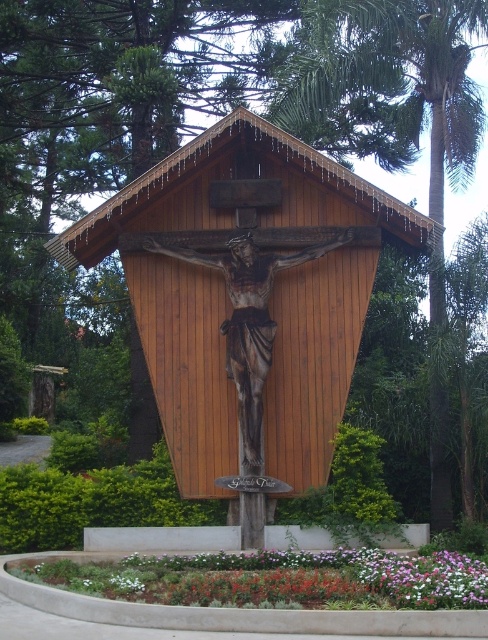
Question: Which point appears closest to the camera in this image?

Choices:
 (A) (367, 26)
 (B) (378, 561)
 (C) (302, 256)

Answer: (B)

Question: Which is nearer to the brown polished wood crucifix at center?

Choices:
 (A) multicolored petals at lower center
 (B) green leafy palm tree at center
 (C) wooden crucifix at center
 (D) white matte flower at lower center

Answer: (C)

Question: Observing the image, what is the correct spatial positioning of multicolored petals at lower center in reference to brown polished wood crucifix at center?

Choices:
 (A) right
 (B) left

Answer: (A)

Question: Which point is closer to the camera?

Choices:
 (A) (258, 257)
 (B) (122, 572)
 (C) (215, 461)
 (D) (368, 4)

Answer: (B)

Question: Is wooden crucifix at center smaller than brown polished wood crucifix at center?

Choices:
 (A) no
 (B) yes

Answer: (A)

Question: Can you confirm if wooden crucifix at center is bigger than white matte flower at lower center?

Choices:
 (A) no
 (B) yes

Answer: (B)